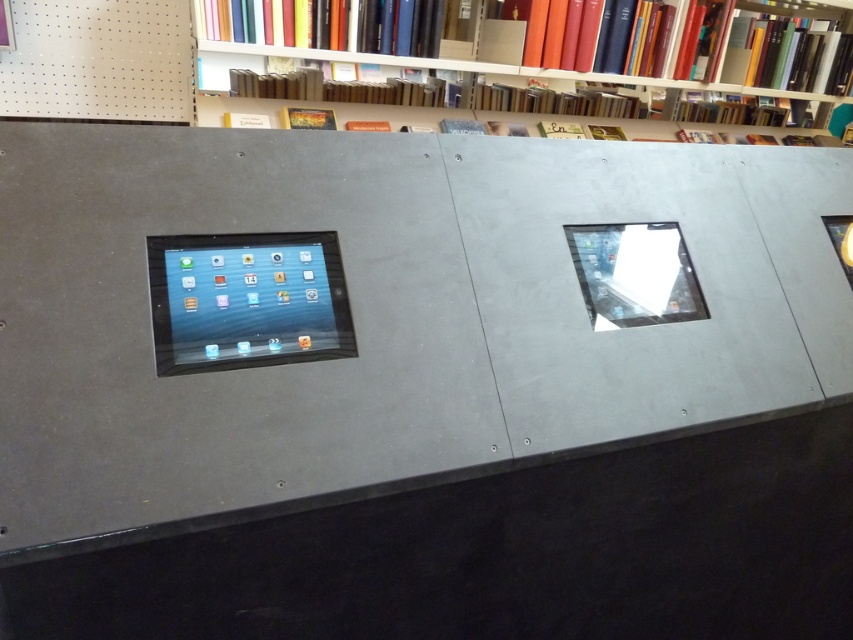
Question: Which of the following is the closest to the observer?

Choices:
 (A) hardcover book at upper center
 (B) glossy plastic tablet at right

Answer: (B)

Question: Does matte gray bookcase at upper center appear on the left side of hardcover book at upper center?

Choices:
 (A) yes
 (B) no

Answer: (B)

Question: Can you confirm if glossy plastic tablet at right is positioned below matte yellow book at upper center?

Choices:
 (A) yes
 (B) no

Answer: (A)

Question: Which of the following is the closest to the observer?

Choices:
 (A) matte black tablet at left
 (B) matte yellow book at upper center
 (C) matte gray bookcase at upper center

Answer: (A)

Question: Is matte black tablet at left to the right of hardcover book at upper center from the viewer's perspective?

Choices:
 (A) no
 (B) yes

Answer: (B)

Question: Which object is closer to the camera taking this photo?

Choices:
 (A) matte black tablet at left
 (B) matte yellow book at upper center

Answer: (A)